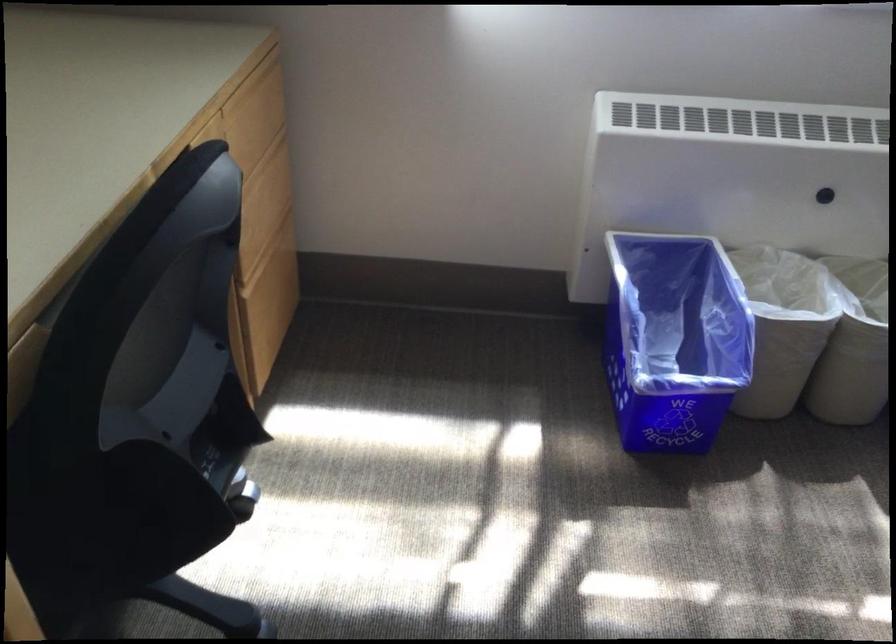
You are a GUI agent. You are given a task and a screenshot of the screen. Output one action in this format:
    pyautogui.click(x=<x>, y=<y>)
    Task: Click on the blue recycling bin
    This screenshot has width=896, height=644.
    Given the screenshot: What is the action you would take?
    pyautogui.click(x=674, y=339)